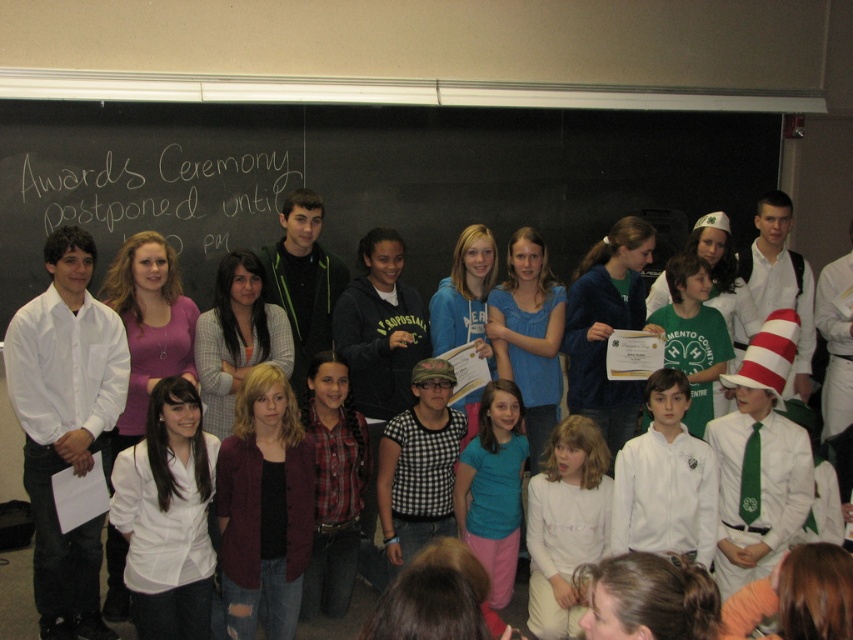
Question: Is white shirt at left below white shirt at right?

Choices:
 (A) yes
 (B) no

Answer: (A)

Question: Is the position of white shirt at left less distant than that of white cotton shirt at center?

Choices:
 (A) no
 (B) yes

Answer: (B)

Question: Does white chalkboard at upper left have a greater width compared to green cotton shirt at center?

Choices:
 (A) yes
 (B) no

Answer: (A)

Question: Among these objects, which one is nearest to the camera?

Choices:
 (A) white shirt at right
 (B) white chalkboard at upper left
 (C) green cotton shirt at center
 (D) white shirt at left

Answer: (D)

Question: Which object is the closest to the white shirt at center?

Choices:
 (A) teal matte shirt at center
 (B) white shirt at right

Answer: (A)

Question: Which point is closer to the camera?

Choices:
 (A) green cotton shirt at center
 (B) white striped hat at right
 (C) black chalkboard at upper center

Answer: (A)